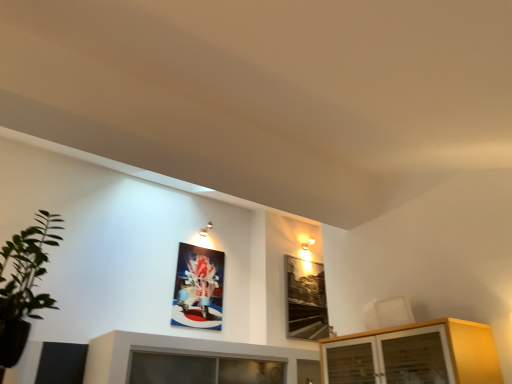
Question: Is metallic glossy picture frame at upper center, placed as the 2th picture frame when sorted from right to left, to the right of light wood cabinet at lower right from the viewer's perspective?

Choices:
 (A) yes
 (B) no

Answer: (B)

Question: Is metallic glossy picture frame at upper center, the first picture frame from the left, facing away from light wood cabinet at lower right?

Choices:
 (A) no
 (B) yes

Answer: (A)

Question: Is metallic glossy picture frame at upper center, placed as the 2th picture frame when sorted from right to left, directly adjacent to light wood cabinet at lower right?

Choices:
 (A) no
 (B) yes

Answer: (A)

Question: Is metallic glossy picture frame at upper center, the first picture frame from the left, aimed at light wood cabinet at lower right?

Choices:
 (A) yes
 (B) no

Answer: (A)

Question: From a real-world perspective, is metallic glossy picture frame at upper center, the first picture frame from the left, physically above light wood cabinet at lower right?

Choices:
 (A) yes
 (B) no

Answer: (A)

Question: Is metallic glossy picture frame at upper center, the first picture frame from the left, wider or thinner than black glass picture frame at upper right, which appears as the first picture frame when viewed from the right?

Choices:
 (A) wide
 (B) thin

Answer: (B)

Question: Would you say metallic glossy picture frame at upper center, placed as the 2th picture frame when sorted from right to left, is to the left or to the right of black glass picture frame at upper right, positioned as the second picture frame in left-to-right order, in the picture?

Choices:
 (A) right
 (B) left

Answer: (B)

Question: Looking at the image, does metallic glossy picture frame at upper center, placed as the 2th picture frame when sorted from right to left, seem bigger or smaller compared to black glass picture frame at upper right, which appears as the first picture frame when viewed from the right?

Choices:
 (A) big
 (B) small

Answer: (B)

Question: From the image's perspective, is metallic glossy picture frame at upper center, placed as the 2th picture frame when sorted from right to left, above or below black glass picture frame at upper right, which appears as the first picture frame when viewed from the right?

Choices:
 (A) above
 (B) below

Answer: (A)

Question: Relative to metallic glossy picture frame at upper center, the first picture frame from the left, is black glass picture frame at upper right, which appears as the first picture frame when viewed from the right, in front or behind?

Choices:
 (A) front
 (B) behind

Answer: (B)

Question: Which is correct: black glass picture frame at upper right, which appears as the first picture frame when viewed from the right, is inside metallic glossy picture frame at upper center, the first picture frame from the left, or outside of it?

Choices:
 (A) outside
 (B) inside

Answer: (A)

Question: From the image's perspective, relative to metallic glossy picture frame at upper center, the first picture frame from the left, is black glass picture frame at upper right, which appears as the first picture frame when viewed from the right, above or below?

Choices:
 (A) above
 (B) below

Answer: (B)

Question: Is black glass picture frame at upper right, which appears as the first picture frame when viewed from the right, bigger or smaller than metallic glossy picture frame at upper center, placed as the 2th picture frame when sorted from right to left?

Choices:
 (A) small
 (B) big

Answer: (B)

Question: Based on their positions, is light wood cabinet at lower right located to the left or right of metallic glossy picture frame at upper center, placed as the 2th picture frame when sorted from right to left?

Choices:
 (A) left
 (B) right

Answer: (B)

Question: Is light wood cabinet at lower right spatially inside metallic glossy picture frame at upper center, the first picture frame from the left, or outside of it?

Choices:
 (A) inside
 (B) outside

Answer: (B)